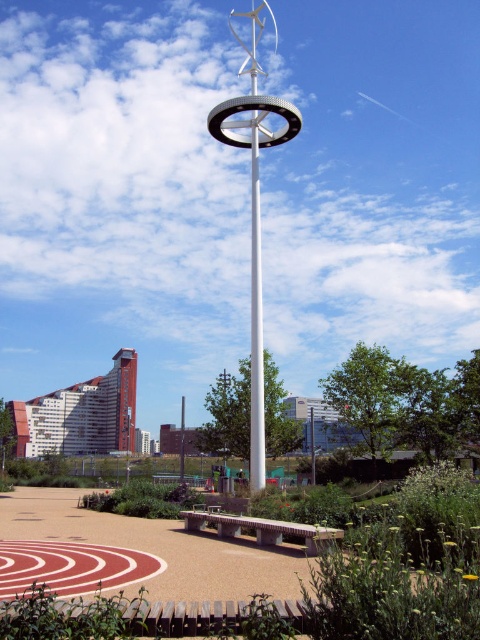
Question: Where is smooth concrete bench at center located in relation to concrete textured bench at center in the image?

Choices:
 (A) above
 (B) below

Answer: (A)

Question: Which point is farther from the camera taking this photo?

Choices:
 (A) (282, 109)
 (B) (453, 492)
 (C) (300, 534)

Answer: (A)

Question: Does smooth concrete bench at center appear on the right side of white glossy wind turbine at center?

Choices:
 (A) yes
 (B) no

Answer: (A)

Question: Which of the following is the closest to the observer?

Choices:
 (A) (111, 620)
 (B) (218, 516)
 (C) (295, 109)

Answer: (A)

Question: Estimate the real-world distances between objects in this image. Which object is farther from the concrete textured bench at center?

Choices:
 (A) smooth concrete bench at center
 (B) white glossy wind turbine at center

Answer: (B)

Question: Can you confirm if smooth concrete bench at center is bigger than concrete textured bench at center?

Choices:
 (A) yes
 (B) no

Answer: (A)